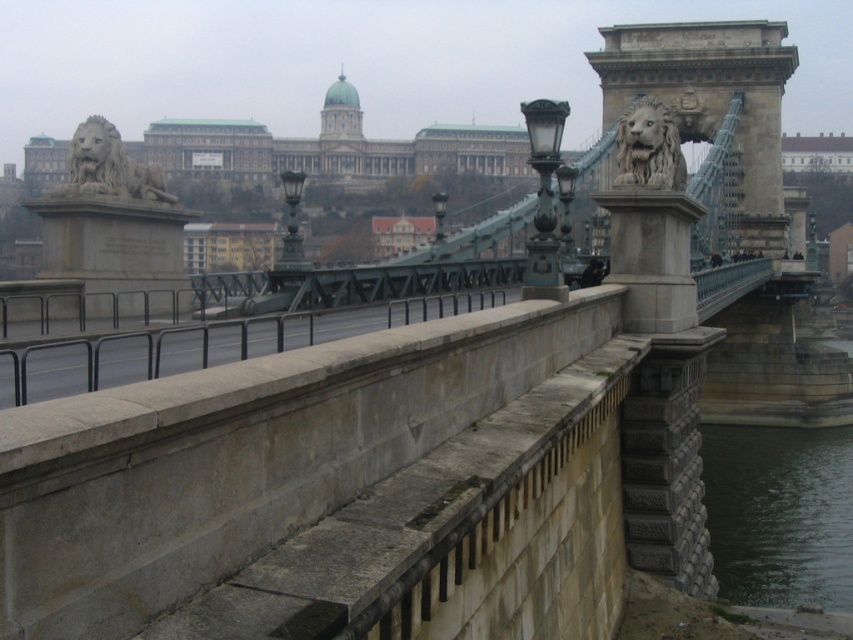
Question: Can you confirm if gray metal rail at center is positioned to the right of gray stone lion at left?

Choices:
 (A) no
 (B) yes

Answer: (B)

Question: Does gray stone lion at left have a greater width compared to stone carved lion at upper center?

Choices:
 (A) yes
 (B) no

Answer: (B)

Question: Where is gray metal rail at center located in relation to gray stone lion at left in the image?

Choices:
 (A) left
 (B) right

Answer: (B)

Question: Which point is closer to the camera taking this photo?

Choices:
 (A) (260, 332)
 (B) (660, 172)

Answer: (A)

Question: Considering the real-world distances, which object is closest to the gray metal rail at center?

Choices:
 (A) stone carved lion at upper center
 (B) gray stone lion at left
 (C) dark green water at lower right

Answer: (B)

Question: Which object appears closest to the camera in this image?

Choices:
 (A) stone carved lion at upper center
 (B) dark green water at lower right
 (C) gray metal rail at center
 (D) gray stone lion at left

Answer: (C)